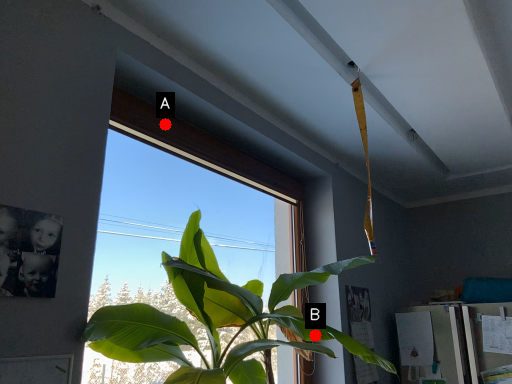
Question: Two points are circled on the image, labeled by A and B beside each circle. Which point is farther from the camera taking this photo?

Choices:
 (A) A is further
 (B) B is further

Answer: (A)